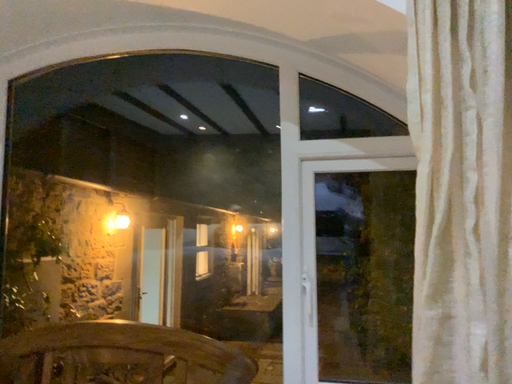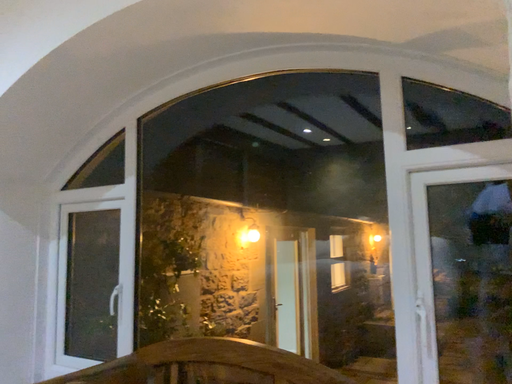
Question: Which way did the camera rotate in the video?

Choices:
 (A) rotated left
 (B) rotated right

Answer: (A)